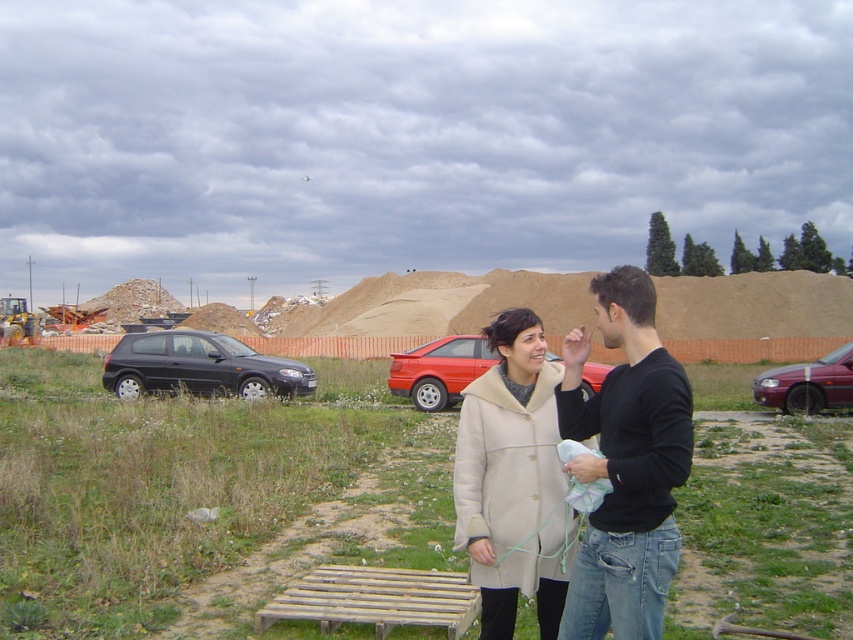
Question: Which of the following is the farthest from the observer?

Choices:
 (A) wooden slats at center
 (B) matte black hatchback at left
 (C) beige wool coat at center

Answer: (B)

Question: Considering the relative positions of wooden bench at center and metallic maroon sedan at right in the image provided, where is wooden bench at center located with respect to metallic maroon sedan at right?

Choices:
 (A) below
 (B) above

Answer: (A)

Question: Can you confirm if black cotton shirt at center is positioned above shiny red car at center?

Choices:
 (A) no
 (B) yes

Answer: (B)

Question: Does black cotton shirt at center have a greater width compared to shiny red car at center?

Choices:
 (A) yes
 (B) no

Answer: (B)

Question: Considering the real-world distances, which object is farthest from the beige wool coat at center?

Choices:
 (A) matte black hatchback at left
 (B) wooden bench at center

Answer: (A)

Question: Which object is closer to the camera taking this photo?

Choices:
 (A) black cotton shirt at center
 (B) wooden bench at center
 (C) shiny red car at center

Answer: (A)